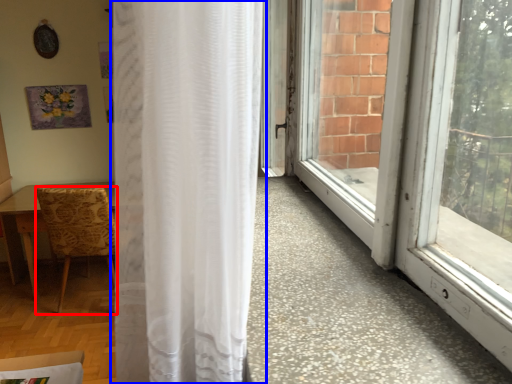
Question: Which object appears closest to the camera in this image, chair (highlighted by a red box) or curtain (highlighted by a blue box)?

Choices:
 (A) chair
 (B) curtain

Answer: (B)